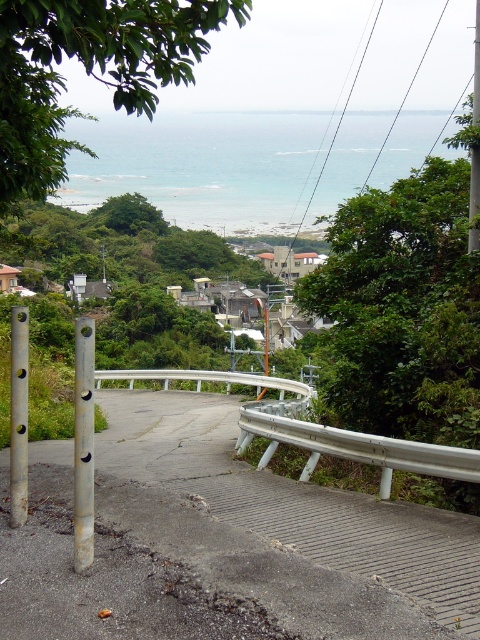
Does silver metallic guardrail at lower right appear under gold metallic pole at left?

Yes, silver metallic guardrail at lower right is below gold metallic pole at left.

Measure the distance from silver metallic guardrail at lower right to gold metallic pole at left.

silver metallic guardrail at lower right is 5.15 meters from gold metallic pole at left.

Which is in front, point (311, 436) or point (73, 540)?

Positioned in front is point (73, 540).

In order to click on silver metallic guardrail at lower right in this screenshot , I will do `click(356, 448)`.

From the picture: Is gold metallic pole at left closer to camera compared to metallic pole at right?

That is True.

Who is more forward, (87, 358) or (470, 211)?

Point (87, 358) is in front.

Between point (90, 520) and point (471, 212), which one is positioned behind?

Point (471, 212)

Where is `gold metallic pole at left`? The image size is (480, 640). gold metallic pole at left is located at coordinates (84, 444).

Which is above, silver metallic pole at left or metallic pole at right?

metallic pole at right

Between point (20, 365) and point (477, 120), which one is positioned behind?

Point (477, 120)

Identify the location of silver metallic pole at left. (19, 416).